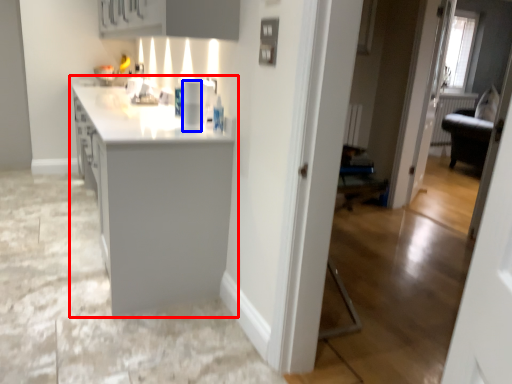
Question: Which of the following is the closest to the observer, countertop (highlighted by a red box) or appliance (highlighted by a blue box)?

Choices:
 (A) countertop
 (B) appliance

Answer: (A)